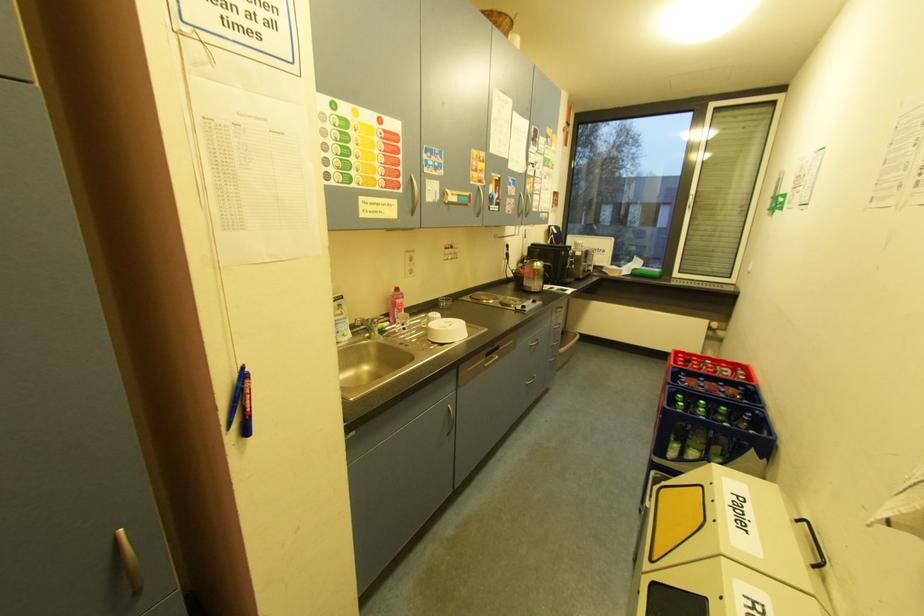
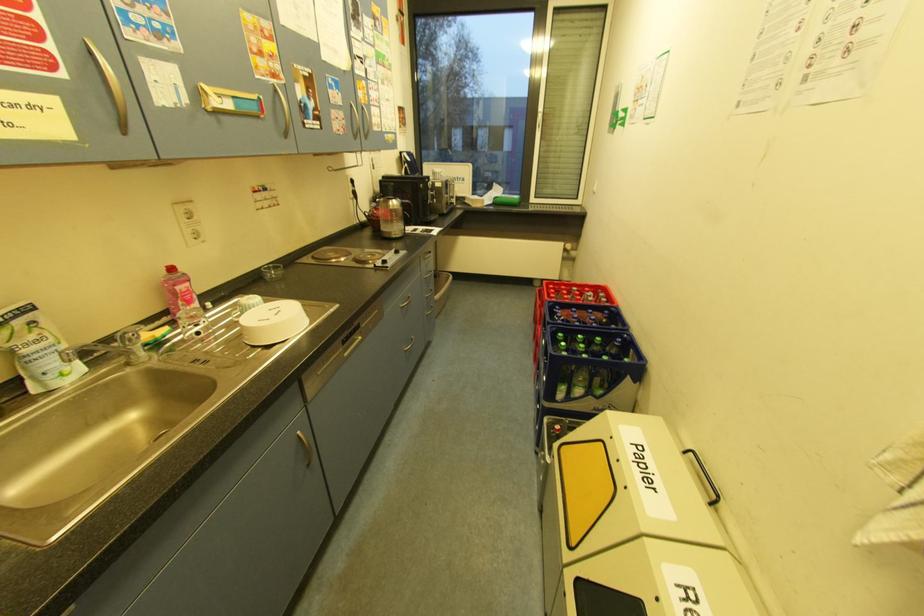
Question: What movement of the cameraman would produce the second image?

Choices:
 (A) Left
 (B) Right
 (C) Forward
 (D) Backward

Answer: (C)